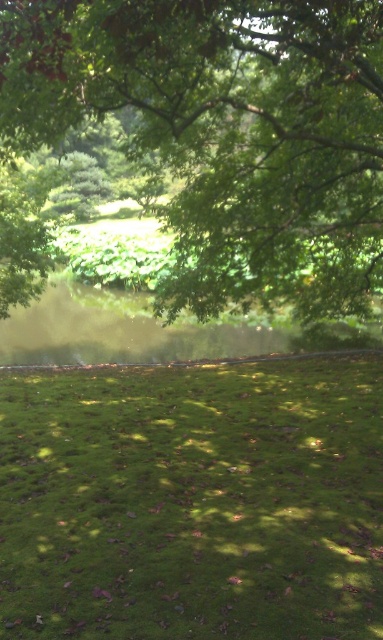
You are standing in the serene outdoor scene with a clear view of the two points marked as point (x=98, y=618) and point (x=24, y=86). Which point is closer to you?

Point (x=98, y=618) is in front of point (x=24, y=86), so it is closer to you.

You are standing at the center of the image and want to walk towards the green grassy field at center. Which direction should you head?

The green grassy field at center is already at the center of the image, so you are already facing it directly.